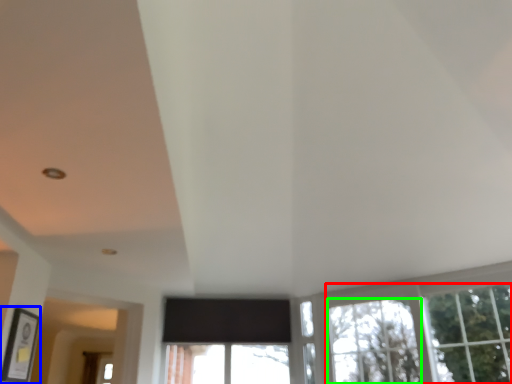
Question: Considering the real-world distances, which object is closest to tree (highlighted by a red box)? picture frame (highlighted by a blue box) or window (highlighted by a green box).

Choices:
 (A) picture frame
 (B) window

Answer: (B)